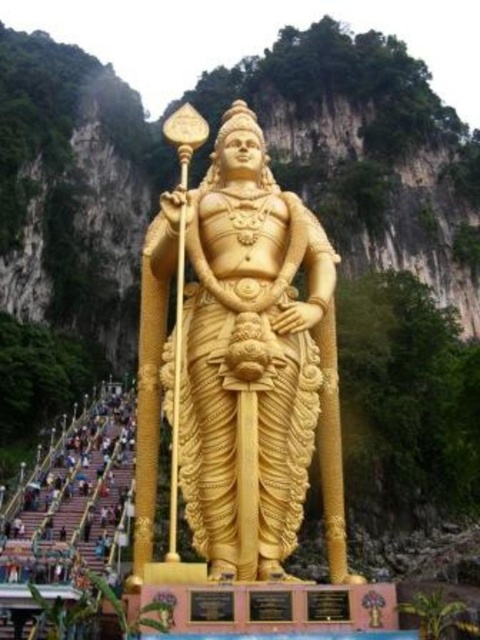
You are a tour guide leading a group to the gold polished statue at center. The group wants to know if they can walk directly from the metallic staircase at lower left to the statue without any obstacles. Based on the scene description, can they proceed straight ahead?

The gold polished statue at center and metallic staircase at lower left are 25.39 meters apart from each other. Since the scene mentions the staircase is flanked by lush greenery and the statue is at the top of the wide staircase, the path from the metallic staircase at lower left to the gold polished statue at center is along the staircase itself. Therefore, they can proceed straight ahead as there are no obstacles mentioned between them.

You are a visitor at the base of the stairs and want to take a photo of the gold polished statue at center without the metallic staircase at lower left appearing in the frame. Is this possible given their sizes?

The gold polished statue at center is larger in size compared to the metallic staircase at lower left. Since the statue is bigger, it might block the view of the staircase if positioned correctly, making it possible to frame the statue without the staircase in the shot.

You are a photographer planning to capture the gold polished statue at center and the metallic staircase at lower left in the same frame. Based on their sizes, which object should appear smaller in the photo?

The gold polished statue at center is thinner than the metallic staircase at lower left, so it should appear smaller in the photo.